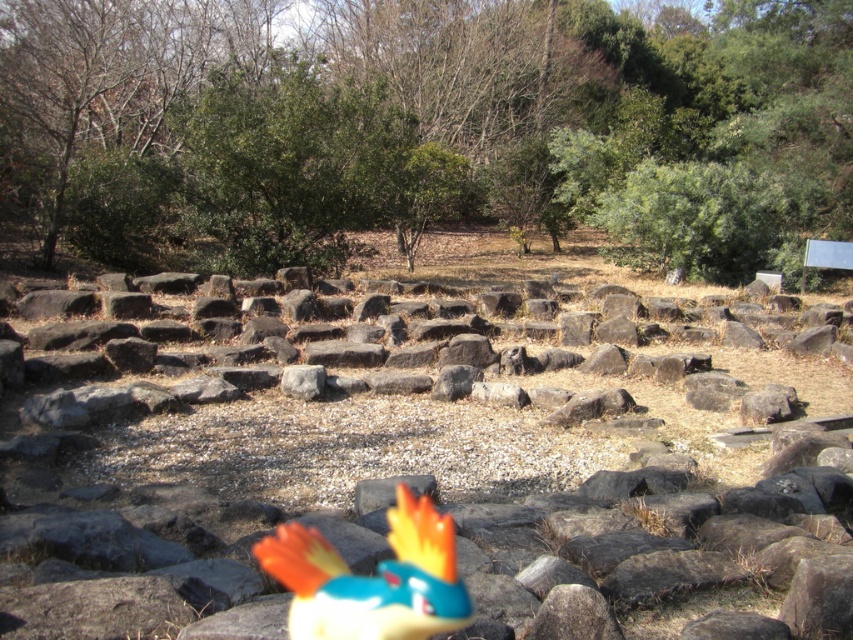
Who is more forward, (387, 481) or (407, 497)?

Point (407, 497) is in front.

Looking at this image, who is more distant from viewer, (x=689, y=525) or (x=370, y=614)?

The point (x=689, y=525) is behind.

At what (x,y) coordinates should I click in order to perform the action: click on smooth gray rocks at center. Please return your answer as a coordinate pair (x, y). The width and height of the screenshot is (853, 640). Looking at the image, I should click on (419, 492).

Does green leafy tree at upper center have a lesser width compared to shiny plastic bird at center?

Incorrect, green leafy tree at upper center's width is not less than shiny plastic bird at center's.

Between point (158, 241) and point (422, 502), which one is positioned behind?

The point (158, 241) is behind.

Where is `green leafy tree at upper center`? The width and height of the screenshot is (853, 640). green leafy tree at upper center is located at coordinates (424, 129).

Is green leafy tree at upper center taller than smooth gray rocks at center?

Yes, green leafy tree at upper center is taller than smooth gray rocks at center.

Between green leafy tree at upper center and smooth gray rocks at center, which one is positioned lower?

smooth gray rocks at center is below.

Does point (50, 212) lie in front of point (248, 625)?

No.

This screenshot has height=640, width=853. I want to click on green leafy tree at upper center, so click(x=424, y=129).